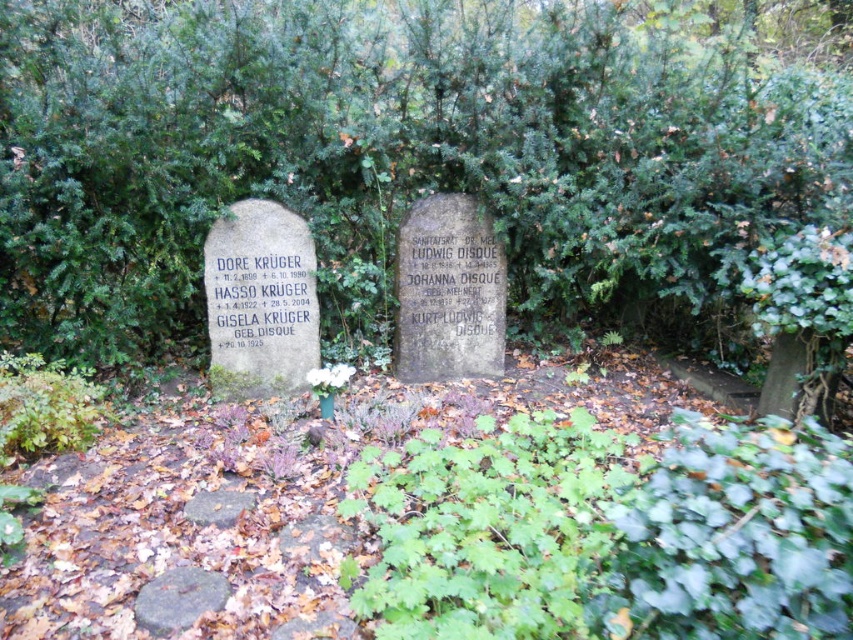
Does point (676, 324) come closer to viewer compared to point (190, 499)?

No, (676, 324) is further to viewer.

Can you confirm if green leafy tree at center is thinner than gray stone at center?

No.

Is point (764, 118) in front of point (196, 499)?

That is False.

Locate an element on the screen. Image resolution: width=853 pixels, height=640 pixels. green leafy tree at center is located at coordinates (389, 156).

How far apart are gray stone gravestone at center and gray stone at center?

gray stone gravestone at center and gray stone at center are 1.37 meters apart.

Does point (437, 378) lie behind point (229, 508)?

Yes, point (437, 378) is farther from viewer.

The image size is (853, 640). In order to click on gray stone gravestone at center in this screenshot , I will do `click(448, 292)`.

Which is behind, point (300, 224) or point (180, 611)?

Point (300, 224)

Image resolution: width=853 pixels, height=640 pixels. Describe the element at coordinates (260, 300) in the screenshot. I see `smooth gray stone at center` at that location.

Locate an element on the screen. smooth gray stone at center is located at coordinates (260, 300).